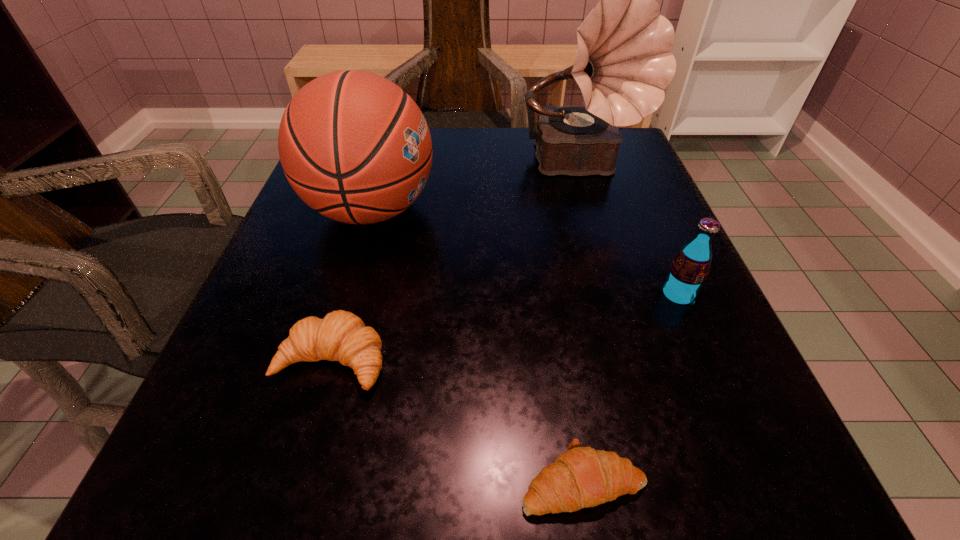
You are a GUI agent. You are given a task and a screenshot of the screen. Output one action in this format:
    pyautogui.click(x=<x>, y=<y>)
    Task: Click on the object located at the far left corner
    
    Given the screenshot: What is the action you would take?
    pyautogui.click(x=354, y=146)

At what (x,y) coordinates should I click in order to perform the action: click on object at the far right corner. Please return your answer as a coordinate pair (x, y). Image resolution: width=960 pixels, height=540 pixels. Looking at the image, I should click on (623, 63).

The image size is (960, 540). In order to click on free location at the far edge in this screenshot , I will do `click(526, 154)`.

Where is `free location at the near edge of the desktop`? Image resolution: width=960 pixels, height=540 pixels. free location at the near edge of the desktop is located at coordinates (551, 517).

At what (x,y) coordinates should I click in order to perform the action: click on vacant space at the left edge of the desktop. Please return your answer as a coordinate pair (x, y). This screenshot has height=540, width=960. Looking at the image, I should click on (x=259, y=362).

The width and height of the screenshot is (960, 540). In the image, there is a desktop. Identify the location of free space at the right edge. (694, 322).

Where is `free space between the farther crescent roll and the record player`? The width and height of the screenshot is (960, 540). free space between the farther crescent roll and the record player is located at coordinates (457, 264).

This screenshot has height=540, width=960. I want to click on free point between the third farthest object and the right crescent roll, so click(630, 388).

Where is `blank region between the record player and the soda`? blank region between the record player and the soda is located at coordinates (630, 231).

Locate an element on the screen. This screenshot has height=540, width=960. vacant space in between the shorter crescent roll and the second tallest object is located at coordinates (477, 345).